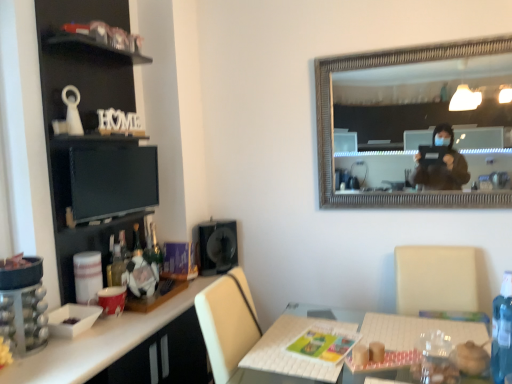
This screenshot has height=384, width=512. In order to click on free point above white glossy desk at lower left (from a real-world perspective) in this screenshot , I will do `click(162, 297)`.